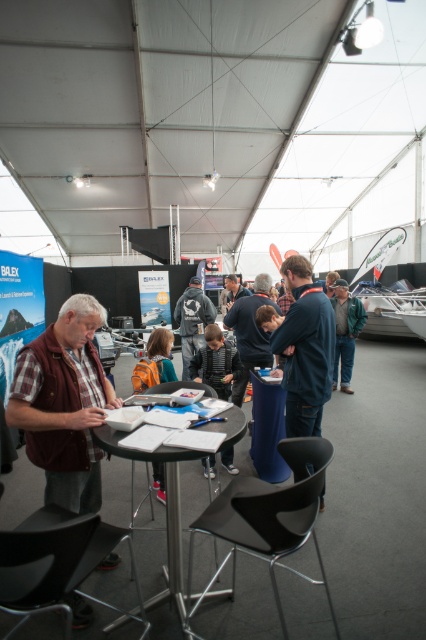
Based on the photo, you are organizing a clothing display and need to know which shirt takes up less space. Which one is narrower between the plaid fabric shirt at center and the dark blue shirt at center?

The plaid fabric shirt at center is narrower than the dark blue shirt at center, so it takes up less space.

You are a photographer standing at the back of the event space. You want to take a photo of the plaid fabric shirt at center and the dark blue shirt at center without any obstruction. Given that your camera has a minimum focus distance of 1 meter, can you capture both subjects clearly in the same frame?

The distance between the plaid fabric shirt at center and the dark blue shirt at center is 1.18 meters. Since the camera requires a minimum focus distance of 1 meter, you can capture both subjects clearly in the same frame as the distance is sufficient.